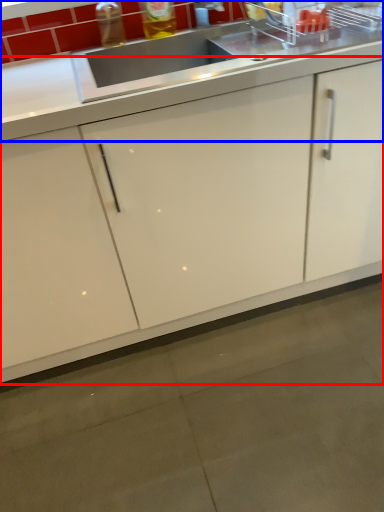
Question: Which object is further to the camera taking this photo, cabinetry (highlighted by a red box) or countertop (highlighted by a blue box)?

Choices:
 (A) cabinetry
 (B) countertop

Answer: (B)